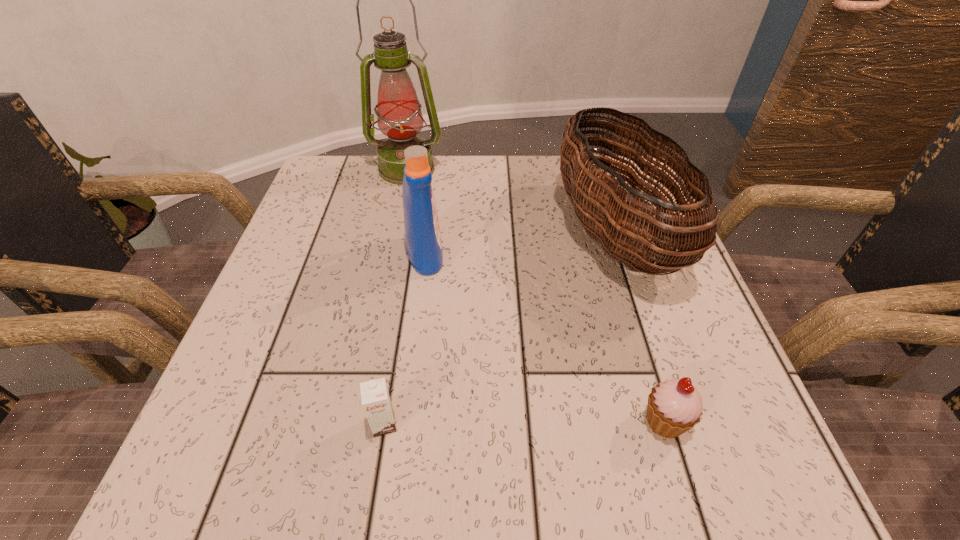
I want to click on oil lamp located in the far edge section of the desktop, so click(399, 117).

Find the location of a particular element. This screenshot has width=960, height=540. basket located at the far edge is located at coordinates (616, 234).

Find the location of a particular element. The width and height of the screenshot is (960, 540). cupcake that is positioned at the near edge is located at coordinates (675, 406).

The image size is (960, 540). Identify the location of chocolate milk that is at the near edge. (376, 402).

You are a GUI agent. You are given a task and a screenshot of the screen. Output one action in this format:
    pyautogui.click(x=<x>, y=<y>)
    Task: Click on the object present at the left edge
    This screenshot has height=540, width=960.
    Given the screenshot: What is the action you would take?
    pyautogui.click(x=399, y=117)

The height and width of the screenshot is (540, 960). Identify the location of basket that is at the right edge. (616, 234).

At what (x,y) coordinates should I click in order to perform the action: click on cupcake situated at the right edge. Please return your answer as a coordinate pair (x, y). Looking at the image, I should click on (675, 406).

I want to click on object present at the far left corner, so click(399, 117).

You are a GUI agent. You are given a task and a screenshot of the screen. Output one action in this format:
    pyautogui.click(x=<x>, y=<y>)
    Task: Click on the object positioned at the far right corner
    
    Given the screenshot: What is the action you would take?
    pyautogui.click(x=616, y=234)

The image size is (960, 540). Identify the location of object present at the near right corner. (675, 406).